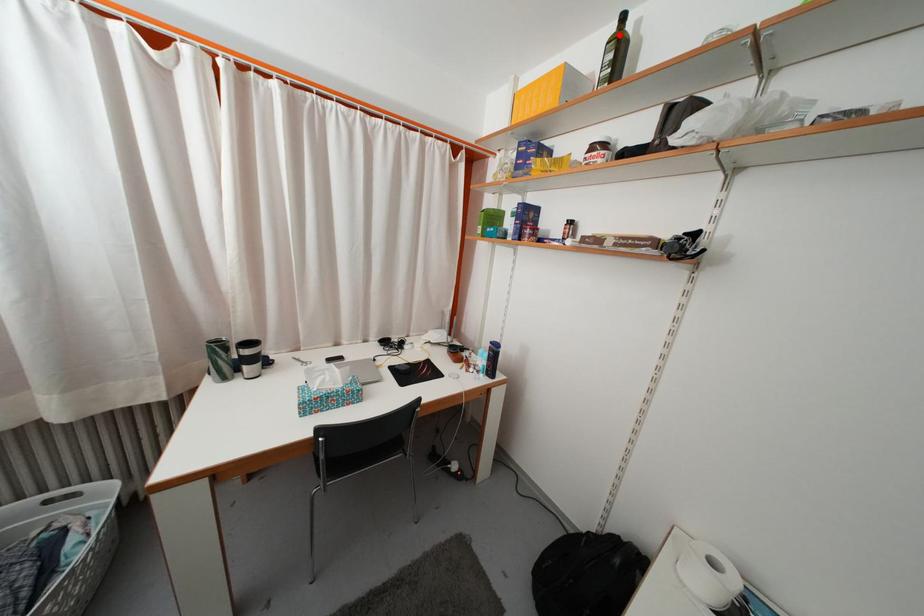
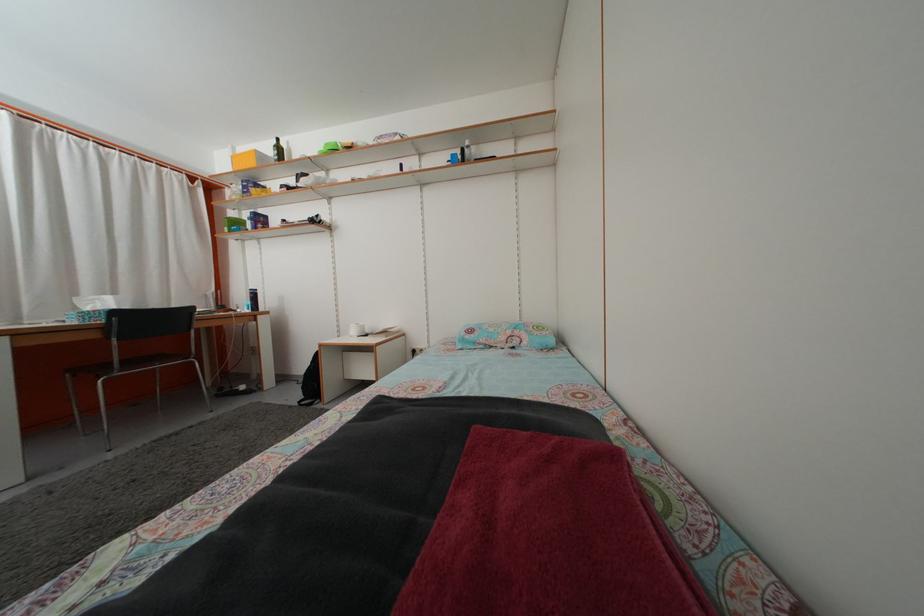
Where in the second image is the point corresponding to the highlighted location from the first image?

(281, 148)